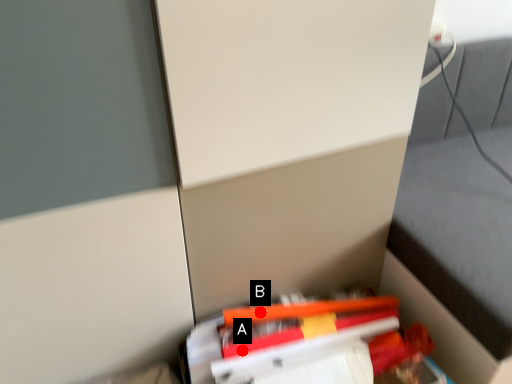
Question: Two points are circled on the image, labeled by A and B beside each circle. Which point is closer to the camera taking this photo?

Choices:
 (A) A is closer
 (B) B is closer

Answer: (A)